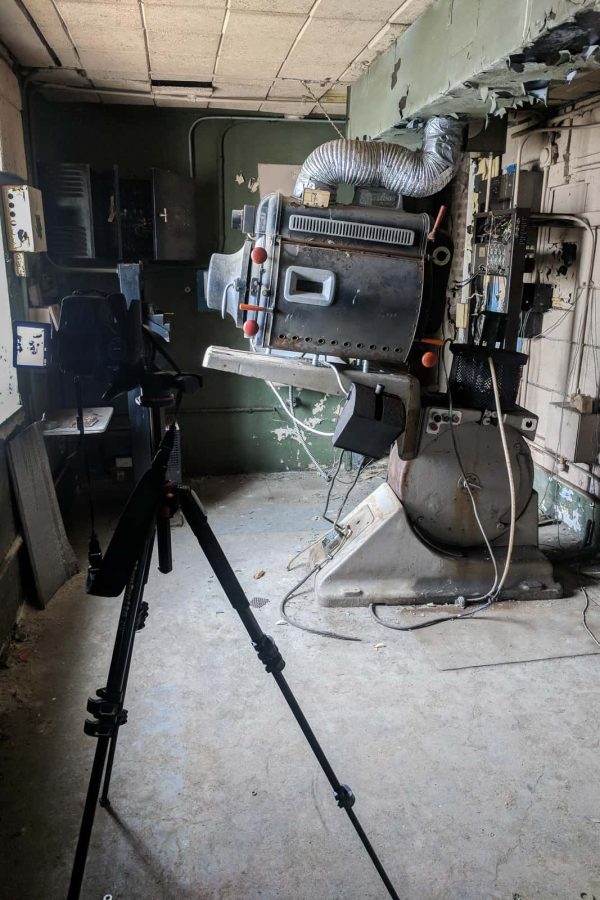
I want to click on white vent, so click(359, 230).